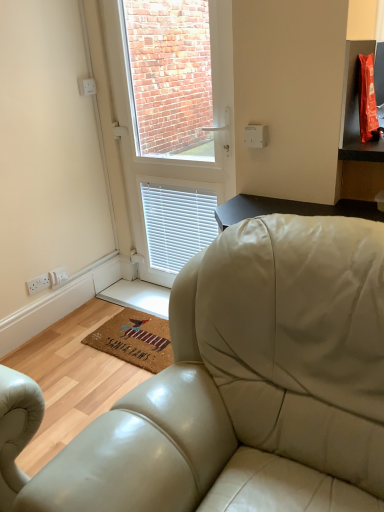
This screenshot has height=512, width=384. Find the location of `vacant area on top of brown coir mat at lower center (from a real-world perspective)`. vacant area on top of brown coir mat at lower center (from a real-world perspective) is located at coordinates (141, 335).